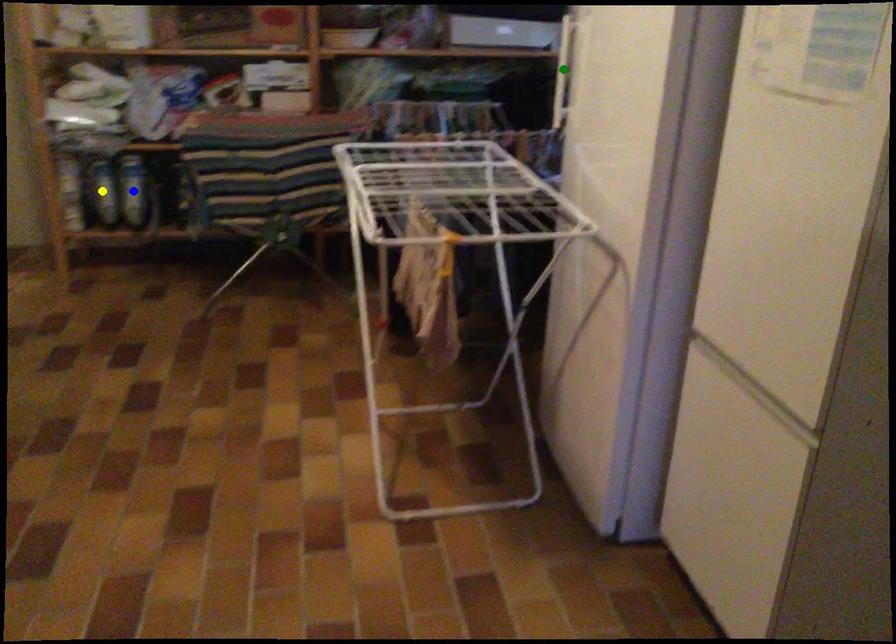
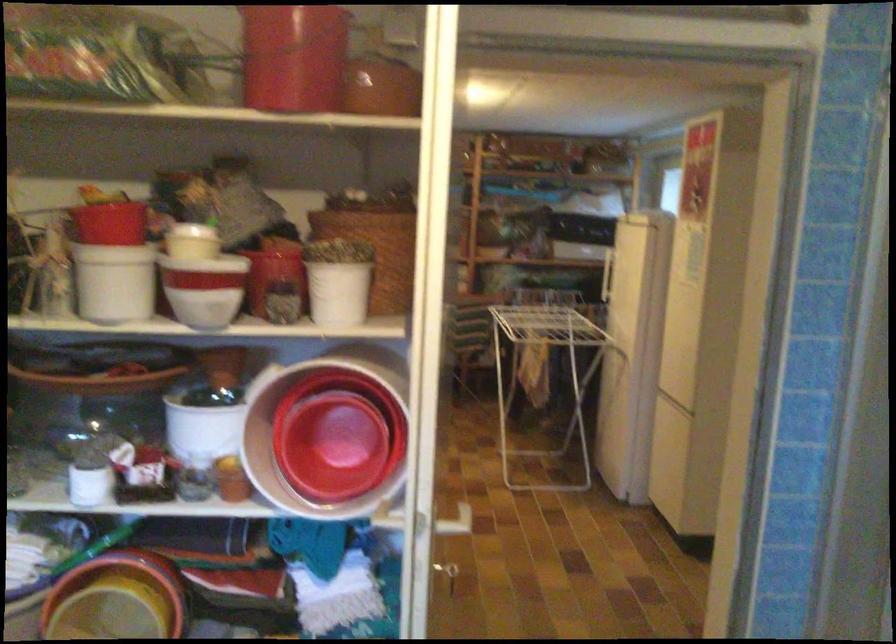
I am providing you with two images of the same scene from different viewpoints. Three points are marked in image1. Which point corresponds to a part or object that is occluded in image2?In image1, three points are marked. Which of them correspond to a part or object that is occluded in image2?Among the three points shown in image1, which one corresponds to a part or object that is no longer visible due to occlusion in image2?

Invisible in image2: blue point, yellow point, green point.